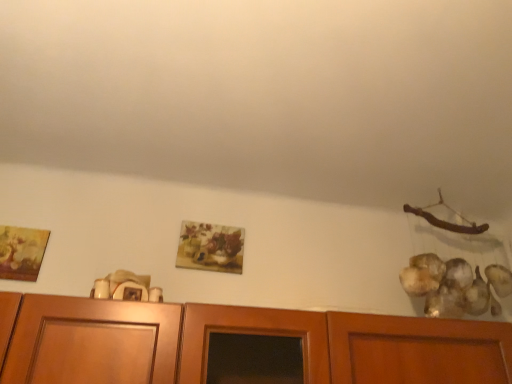
Question: Is the position of matte floral print at center, which is the second picture frame in front-to-back order, more distant than that of matte gold picture frame at left, which is counted as the second picture frame, starting from the right?

Choices:
 (A) yes
 (B) no

Answer: (A)

Question: Considering the relative positions of matte floral print at center, the 2th picture frame positioned from the left, and matte gold picture frame at left, placed as the 2th picture frame when sorted from back to front, in the image provided, is matte floral print at center, the 2th picture frame positioned from the left, to the left of matte gold picture frame at left, placed as the 2th picture frame when sorted from back to front, from the viewer's perspective?

Choices:
 (A) yes
 (B) no

Answer: (B)

Question: From the image's perspective, is matte floral print at center, which is counted as the 1th picture frame, starting from the right, above matte gold picture frame at left, placed as the 2th picture frame when sorted from back to front?

Choices:
 (A) no
 (B) yes

Answer: (A)

Question: Is matte floral print at center, which is the second picture frame in front-to-back order, located outside matte gold picture frame at left, which appears as the 1th picture frame when viewed from the front?

Choices:
 (A) yes
 (B) no

Answer: (A)

Question: From the image's perspective, is matte floral print at center, which is counted as the 1th picture frame, starting from the right, below matte gold picture frame at left, which is counted as the second picture frame, starting from the right?

Choices:
 (A) no
 (B) yes

Answer: (B)

Question: Would you consider matte floral print at center, the 2th picture frame positioned from the left, to be distant from matte gold picture frame at left, which is counted as the second picture frame, starting from the right?

Choices:
 (A) yes
 (B) no

Answer: (B)

Question: Is matte gold picture frame at left, which appears as the first picture frame when viewed from the left, with matte floral print at center, which is counted as the 1th picture frame, starting from the right?

Choices:
 (A) yes
 (B) no

Answer: (B)

Question: From a real-world perspective, is matte gold picture frame at left, which appears as the 1th picture frame when viewed from the front, located higher than matte floral print at center, which is the second picture frame in front-to-back order?

Choices:
 (A) yes
 (B) no

Answer: (B)

Question: Can you confirm if matte gold picture frame at left, which is counted as the second picture frame, starting from the right, is taller than matte floral print at center, which is the second picture frame in front-to-back order?

Choices:
 (A) yes
 (B) no

Answer: (B)

Question: From a real-world perspective, is matte gold picture frame at left, placed as the 2th picture frame when sorted from back to front, physically below matte floral print at center, the 2th picture frame positioned from the left?

Choices:
 (A) yes
 (B) no

Answer: (A)

Question: Could you tell me if matte gold picture frame at left, which appears as the first picture frame when viewed from the left, is turned towards matte floral print at center, which is the second picture frame in front-to-back order?

Choices:
 (A) yes
 (B) no

Answer: (B)

Question: Considering the relative sizes of matte gold picture frame at left, which appears as the 1th picture frame when viewed from the front, and matte floral print at center, which is the second picture frame in front-to-back order, in the image provided, is matte gold picture frame at left, which appears as the 1th picture frame when viewed from the front, shorter than matte floral print at center, which is the second picture frame in front-to-back order,?

Choices:
 (A) no
 (B) yes

Answer: (B)

Question: Relative to matte gold picture frame at left, which appears as the first picture frame when viewed from the left, is matte floral print at center, the 2th picture frame positioned from the left, in front or behind?

Choices:
 (A) front
 (B) behind

Answer: (B)